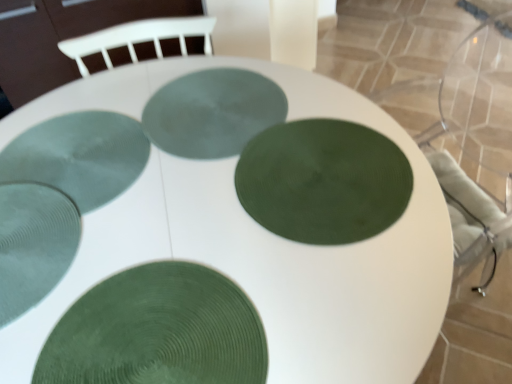
Locate an element on the screen. The height and width of the screenshot is (384, 512). free space to the left of green textured glass plate at center, positioned as the 3th glass plate in back-to-front order is located at coordinates (157, 200).